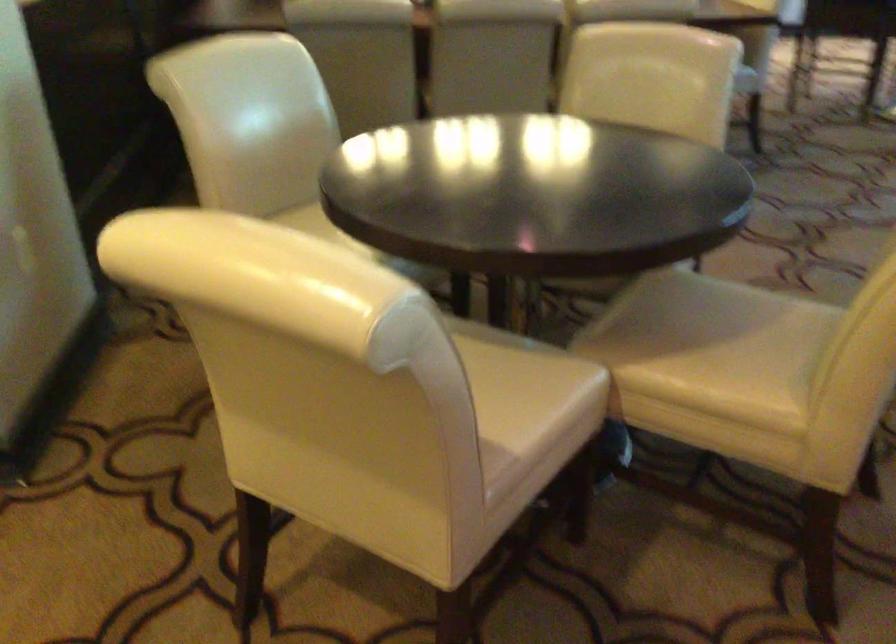
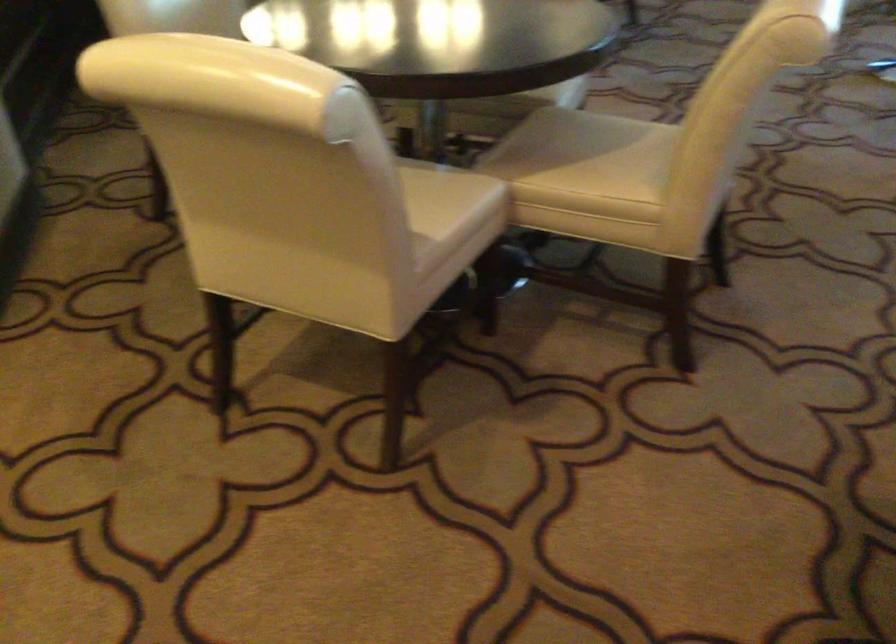
Find the pixel in the second image that matches pixel 523 348 in the first image.

(437, 167)